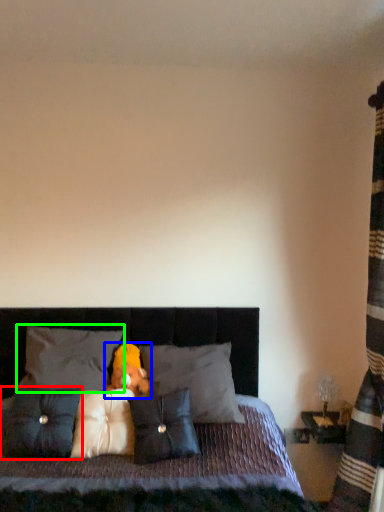
Question: Based on their relative distances, which object is farther from pillow (highlighted by a red box)? Choose from teddy bear (highlighted by a blue box) and pillow (highlighted by a green box).

Choices:
 (A) teddy bear
 (B) pillow

Answer: (A)